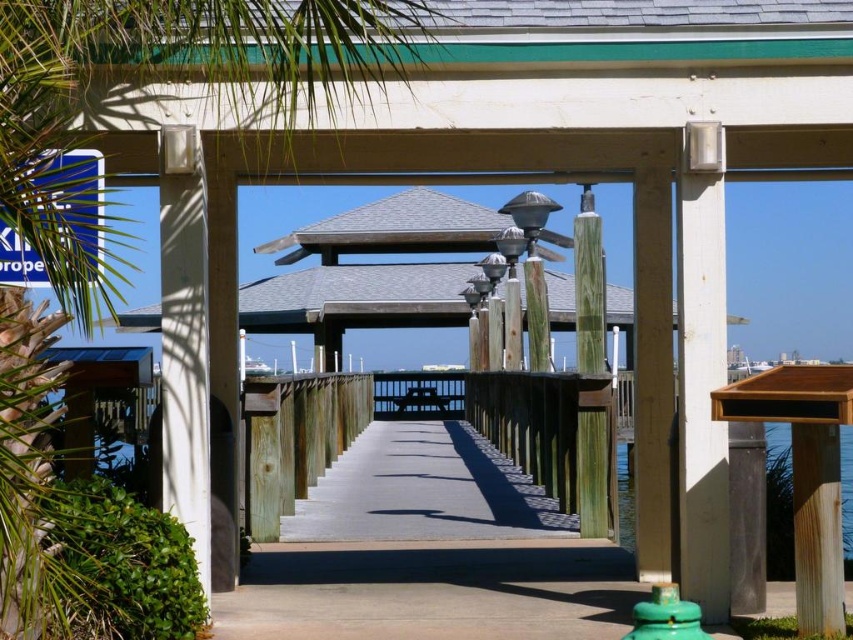
Which of these two, green leafy palm tree at left or white wood post at center, stands taller?

green leafy palm tree at left is taller.

Can you confirm if green leafy palm tree at left is taller than white wood post at center?

Correct, green leafy palm tree at left is much taller as white wood post at center.

This screenshot has height=640, width=853. What do you see at coordinates (65, 195) in the screenshot?
I see `green leafy palm tree at left` at bounding box center [65, 195].

The height and width of the screenshot is (640, 853). In order to click on green leafy palm tree at left in this screenshot , I will do `click(65, 195)`.

Is white wood post at center smaller than green weathered wood post at center?

Yes.

Who is higher up, white wood post at center or green weathered wood post at center?

green weathered wood post at center is higher up.

Is point (171, 372) farther from camera compared to point (601, 284)?

That is False.

Where is `white wood post at center`? The width and height of the screenshot is (853, 640). white wood post at center is located at coordinates (184, 339).

Is green leafy palm tree at left to the right of clear wood water at center from the viewer's perspective?

In fact, green leafy palm tree at left is to the left of clear wood water at center.

Who is more distant from viewer, (291, 19) or (619, 508)?

The point (619, 508) is behind.

Between point (366, 26) and point (843, 440), which one is positioned in front?

Positioned in front is point (366, 26).

You are a GUI agent. You are given a task and a screenshot of the screen. Output one action in this format:
    pyautogui.click(x=<x>, y=<y>)
    Task: Click on the green leafy palm tree at left
    Image resolution: width=853 pixels, height=640 pixels.
    Given the screenshot: What is the action you would take?
    pyautogui.click(x=65, y=195)